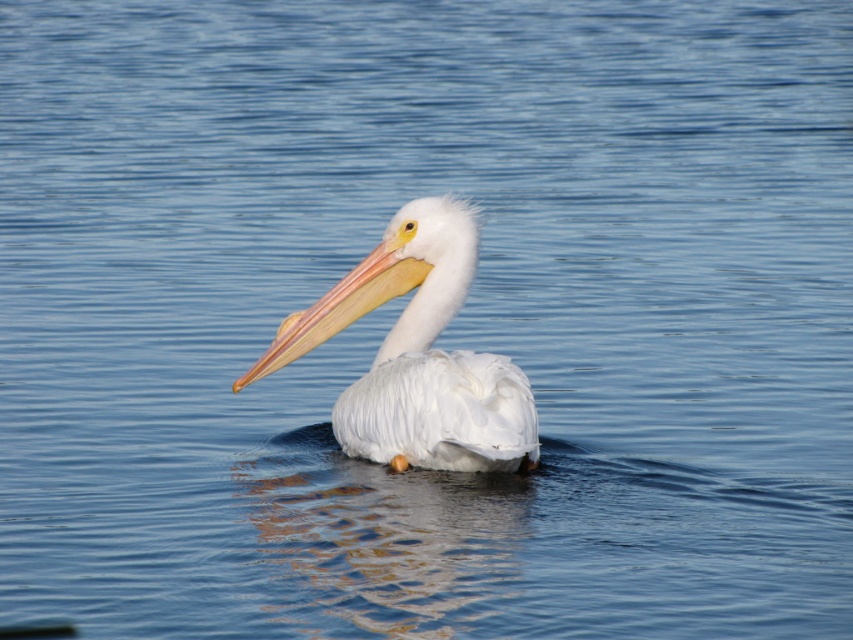
Which is more to the left, white feathered pelican at center or matte orange beak at center?

matte orange beak at center is more to the left.

You are a GUI agent. You are given a task and a screenshot of the screen. Output one action in this format:
    pyautogui.click(x=<x>, y=<y>)
    Task: Click on the white feathered pelican at center
    
    Given the screenshot: What is the action you would take?
    pyautogui.click(x=416, y=355)